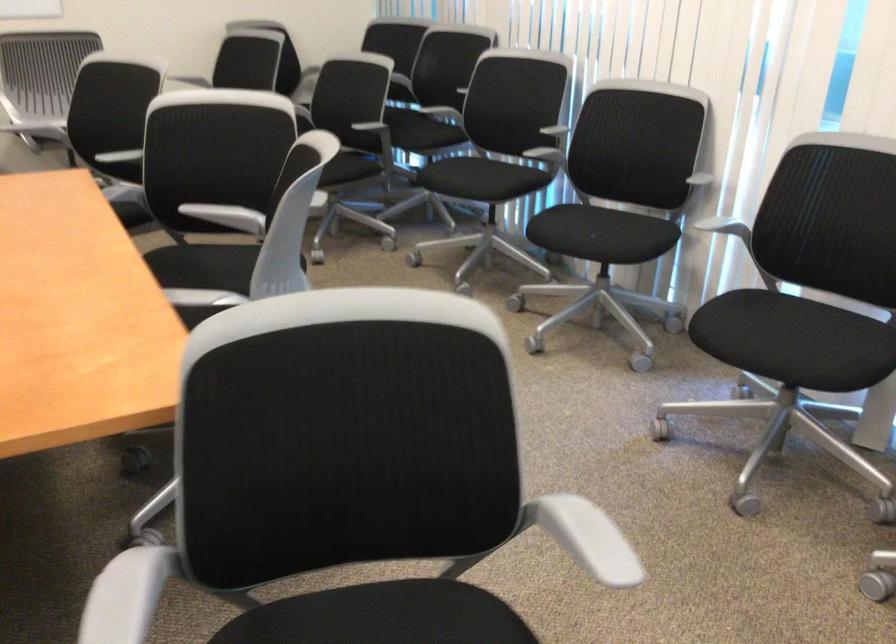
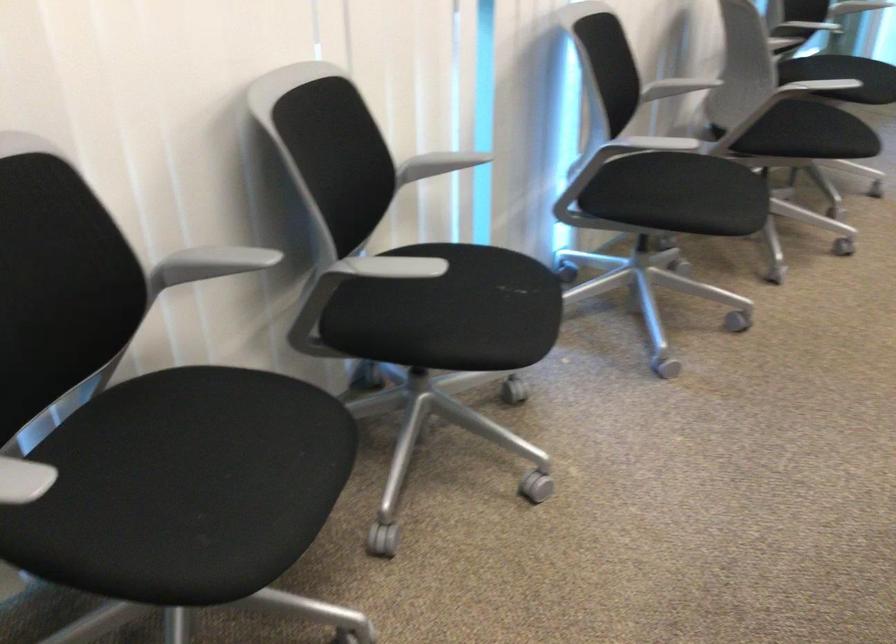
Where in the second image is the point corresponding to (536,154) from the first image?

(384, 267)